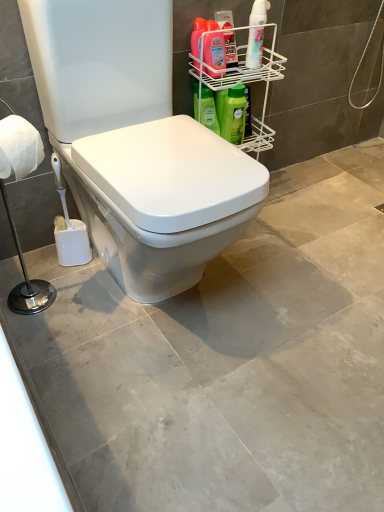
The image size is (384, 512). Identify the location of white wire rack at upper right. (244, 80).

The image size is (384, 512). I want to click on matte pink bottle at upper right, which is the 3th cleaning product from left to right, so (x=230, y=49).

In the scene shown: Which object is positioned more to the left, white wire rack at upper right or matte pink bottle at upper right, positioned as the 2th cleaning product in left-to-right order?

matte pink bottle at upper right, positioned as the 2th cleaning product in left-to-right order, is more to the left.

In order to click on shelf located on the right of matte pink bottle at upper right, positioned as the 2th cleaning product in left-to-right order in this screenshot , I will do click(244, 80).

From the picture: Is white wire rack at upper right in front of or behind matte pink bottle at upper right, the 4th cleaning product from the right, in the image?

Visually, white wire rack at upper right is located in front of matte pink bottle at upper right, the 4th cleaning product from the right.

Is white glossy spray bottle at upper right, the first cleaning product positioned from the right, wider or thinner than green matte bottle at upper right, the first cleaning product positioned from the left?

In the image, white glossy spray bottle at upper right, the first cleaning product positioned from the right, appears to be more narrow than green matte bottle at upper right, the first cleaning product positioned from the left.

Measure the distance from white glossy spray bottle at upper right, the first cleaning product positioned from the right, to green matte bottle at upper right, the 5th cleaning product when ordered from right to left.

white glossy spray bottle at upper right, the first cleaning product positioned from the right, and green matte bottle at upper right, the 5th cleaning product when ordered from right to left, are 9.06 inches apart from each other.

From a real-world perspective, which object stands above the other?

white glossy spray bottle at upper right, the first cleaning product positioned from the right, from a real-world perspective.

In the scene shown: How many degrees apart are the facing directions of white glossy spray bottle at upper right, acting as the fifth cleaning product starting from the left, and green matte bottle at upper right, the first cleaning product positioned from the left?

There is a 1.13-degree angle between the facing directions of white glossy spray bottle at upper right, acting as the fifth cleaning product starting from the left, and green matte bottle at upper right, the first cleaning product positioned from the left.

Which is more distant, (210,55) or (223,29)?

The point (210,55) is farther from the camera.

Locate an element on the screen. shelf in front of the matte pink bottle at upper right, positioned as the 2th cleaning product in left-to-right order is located at coordinates (244, 80).

Is matte pink bottle at upper right, the 4th cleaning product from the right, facing away from white wire rack at upper right?

That's right, matte pink bottle at upper right, the 4th cleaning product from the right, is facing away from white wire rack at upper right.

Considering the sizes of objects matte pink bottle at upper right, positioned as the 2th cleaning product in left-to-right order, and white wire rack at upper right in the image provided, who is smaller, matte pink bottle at upper right, positioned as the 2th cleaning product in left-to-right order, or white wire rack at upper right?

matte pink bottle at upper right, positioned as the 2th cleaning product in left-to-right order, is smaller.

Would you say matte pink bottle at upper right, which is the 3th cleaning product from left to right, contains white glossy toilet at center?

No.

In terms of height, does matte pink bottle at upper right, the 3th cleaning product positioned from the right, look taller or shorter compared to white glossy toilet at center?

In the image, matte pink bottle at upper right, the 3th cleaning product positioned from the right, appears to be shorter than white glossy toilet at center.

In the scene shown: In the image, is matte pink bottle at upper right, the 3th cleaning product positioned from the right, on the left side or the right side of white glossy toilet at center?

Based on their positions, matte pink bottle at upper right, the 3th cleaning product positioned from the right, is located to the right of white glossy toilet at center.

Is matte pink bottle at upper right, which is the 3th cleaning product from left to right, thinner than white glossy toilet at center?

Indeed, matte pink bottle at upper right, which is the 3th cleaning product from left to right, has a lesser width compared to white glossy toilet at center.

Is green matte bottle at upper right, positioned as the 4th cleaning product in left-to-right order, positioned before matte pink bottle at upper right, which is the 3th cleaning product from left to right?

No, green matte bottle at upper right, positioned as the 4th cleaning product in left-to-right order, is further to the viewer.

Is green matte bottle at upper right, the second cleaning product in the right-to-left sequence, wider than matte pink bottle at upper right, the 3th cleaning product positioned from the right?

Correct, the width of green matte bottle at upper right, the second cleaning product in the right-to-left sequence, exceeds that of matte pink bottle at upper right, the 3th cleaning product positioned from the right.

In terms of size, does green matte bottle at upper right, positioned as the 4th cleaning product in left-to-right order, appear bigger or smaller than matte pink bottle at upper right, the 3th cleaning product positioned from the right?

In the image, green matte bottle at upper right, positioned as the 4th cleaning product in left-to-right order, appears to be larger than matte pink bottle at upper right, the 3th cleaning product positioned from the right.

Does white glossy spray bottle at upper right, acting as the fifth cleaning product starting from the left, have a smaller size compared to white matte toilet paper at left?

Yes, white glossy spray bottle at upper right, acting as the fifth cleaning product starting from the left, is smaller than white matte toilet paper at left.

From a real-world perspective, is white glossy spray bottle at upper right, the first cleaning product positioned from the right, positioned over white matte toilet paper at left based on gravity?

Indeed, from a real-world perspective, white glossy spray bottle at upper right, the first cleaning product positioned from the right, stands above white matte toilet paper at left.

Considering the sizes of white glossy spray bottle at upper right, acting as the fifth cleaning product starting from the left, and white matte toilet paper at left in the image, is white glossy spray bottle at upper right, acting as the fifth cleaning product starting from the left, taller or shorter than white matte toilet paper at left?

Clearly, white glossy spray bottle at upper right, acting as the fifth cleaning product starting from the left, is taller compared to white matte toilet paper at left.

From the image's perspective, between white wire rack at upper right and matte pink bottle at upper right, the 3th cleaning product positioned from the right, who is located below?

white wire rack at upper right, from the image's perspective.

Is white wire rack at upper right far away from matte pink bottle at upper right, which is the 3th cleaning product from left to right?

No, white wire rack at upper right is in close proximity to matte pink bottle at upper right, which is the 3th cleaning product from left to right.

Locate an element on the screen. Image resolution: width=384 pixels, height=512 pixels. shelf located below the matte pink bottle at upper right, the 3th cleaning product positioned from the right (from the image's perspective) is located at coordinates coord(244,80).

Find the location of a particular element. The image size is (384, 512). the 2nd cleaning product counting from the left of the white wire rack at upper right is located at coordinates (214, 46).

From a real-world perspective, count 4th cleaning products downward from the white glossy spray bottle at upper right, acting as the fifth cleaning product starting from the left, and point to it. Please provide its 2D coordinates.

[(209, 110)]

Considering their positions, is white wire rack at upper right positioned closer to white matte toilet paper at left than matte pink bottle at upper right, which is the 3th cleaning product from left to right?

The object closer to white matte toilet paper at left is white wire rack at upper right.

Which object lies nearer to the anchor point green matte bottle at upper right, positioned as the 4th cleaning product in left-to-right order, white glossy spray bottle at upper right, the first cleaning product positioned from the right, or matte pink bottle at upper right, which is the 3th cleaning product from left to right?

matte pink bottle at upper right, which is the 3th cleaning product from left to right, is closer to green matte bottle at upper right, positioned as the 4th cleaning product in left-to-right order.

When comparing their distances from white wire rack at upper right, does green matte bottle at upper right, the second cleaning product in the right-to-left sequence, or white glossy toilet at center seem closer?

green matte bottle at upper right, the second cleaning product in the right-to-left sequence.

Estimate the real-world distances between objects in this image. Which object is further from matte pink bottle at upper right, the 3th cleaning product positioned from the right, white glossy spray bottle at upper right, the first cleaning product positioned from the right, or green matte bottle at upper right, the second cleaning product in the right-to-left sequence?

Based on the image, green matte bottle at upper right, the second cleaning product in the right-to-left sequence, appears to be further to matte pink bottle at upper right, the 3th cleaning product positioned from the right.

From the image, which object appears to be farther from green matte bottle at upper right, the 5th cleaning product when ordered from right to left, matte pink bottle at upper right, positioned as the 2th cleaning product in left-to-right order, or green matte bottle at upper right, positioned as the 4th cleaning product in left-to-right order?

matte pink bottle at upper right, positioned as the 2th cleaning product in left-to-right order, is positioned further to the anchor green matte bottle at upper right, the 5th cleaning product when ordered from right to left.

Estimate the real-world distances between objects in this image. Which object is further from white matte toilet paper at left, matte pink bottle at upper right, the 4th cleaning product from the right, or white wire rack at upper right?

Based on the image, white wire rack at upper right appears to be further to white matte toilet paper at left.

When comparing their distances from green matte bottle at upper right, the second cleaning product in the right-to-left sequence, does white wire rack at upper right or white matte toilet paper at left seem closer?

white wire rack at upper right.

Consider the image. From the image, which object appears to be farther from matte pink bottle at upper right, which is the 3th cleaning product from left to right, white wire rack at upper right or white glossy toilet at center?

white glossy toilet at center is further to matte pink bottle at upper right, which is the 3th cleaning product from left to right.

Find the location of `cleaning product positioned between white glossy toilet at center and white glossy spray bottle at upper right, acting as the fifth cleaning product starting from the left, from near to far`. cleaning product positioned between white glossy toilet at center and white glossy spray bottle at upper right, acting as the fifth cleaning product starting from the left, from near to far is located at coordinates (214, 46).

You are a GUI agent. You are given a task and a screenshot of the screen. Output one action in this format:
    pyautogui.click(x=<x>, y=<y>)
    Task: Click on the toilet paper positioned between white glossy toilet at center and matte pink bottle at upper right, positioned as the 2th cleaning product in left-to-right order, from near to far
    
    Given the screenshot: What is the action you would take?
    pyautogui.click(x=19, y=147)

This screenshot has width=384, height=512. Identify the location of shelf between white glossy toilet at center and green matte bottle at upper right, positioned as the 4th cleaning product in left-to-right order, from front to back. click(244, 80).

This screenshot has width=384, height=512. In order to click on toilet paper located between white glossy toilet at center and matte pink bottle at upper right, the 3th cleaning product positioned from the right, in the depth direction in this screenshot , I will do `click(19, 147)`.